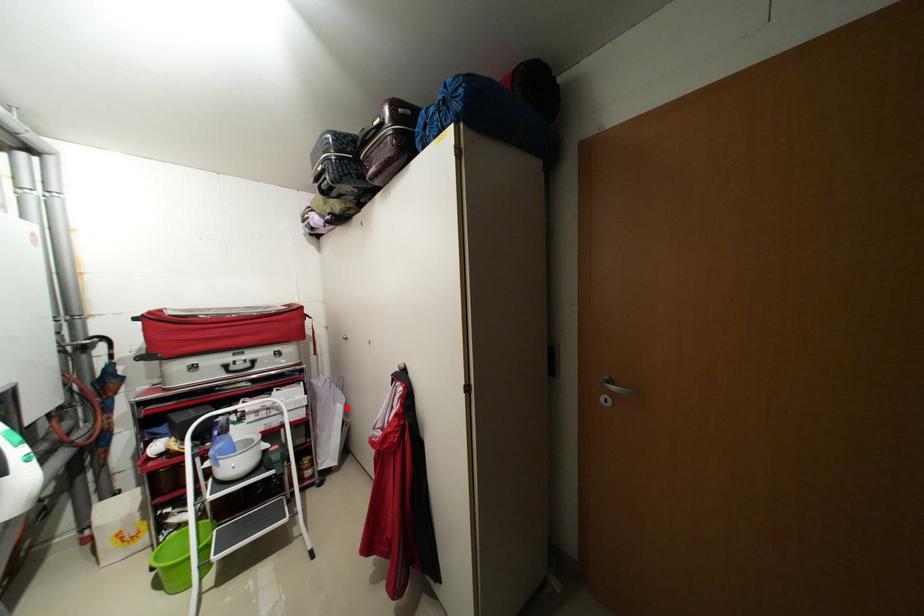
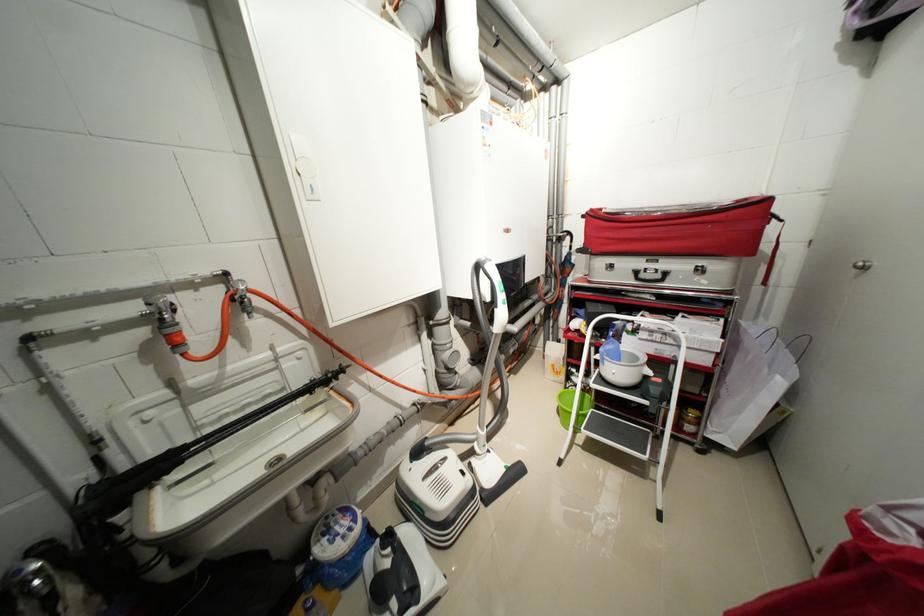
Question: I am providing you with two images of the same scene from different viewpoints. In image1, a red point is highlighted. Considering the same 3D point in image2, which of the following is correct?

Choices:
 (A) It is closer
 (B) It is farther

Answer: (A)